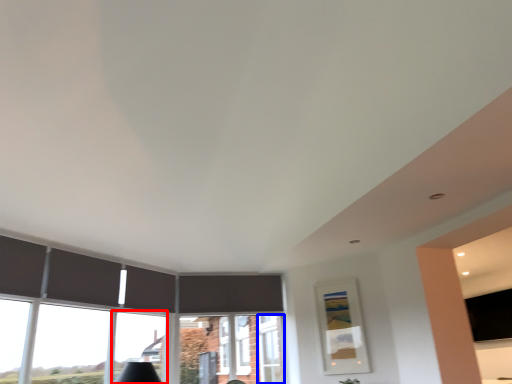
Question: Which object is further to the camera taking this photo, window (highlighted by a red box) or window frame (highlighted by a blue box)?

Choices:
 (A) window
 (B) window frame

Answer: (B)